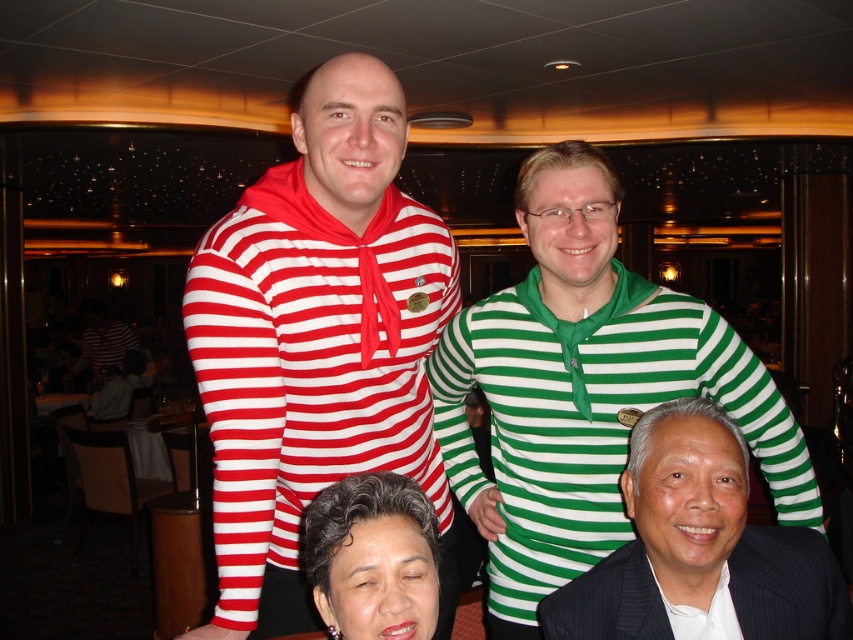
Measure the distance from matte red and white striped hoodie at center to green striped shirt at upper right.

They are 10.96 inches apart.

Is matte red and white striped hoodie at center smaller than green striped shirt at upper right?

Correct, matte red and white striped hoodie at center occupies less space than green striped shirt at upper right.

Is point (450, 252) farther from camera compared to point (543, 464)?

That is True.

Image resolution: width=853 pixels, height=640 pixels. I want to click on matte red and white striped hoodie at center, so [x=317, y=342].

Is matte red and white striped hoodie at center thinner than smooth black hair at lower center?

No.

Who is positioned more to the right, matte red and white striped hoodie at center or smooth black hair at lower center?

Positioned to the right is smooth black hair at lower center.

The height and width of the screenshot is (640, 853). What are the coordinates of `matte red and white striped hoodie at center` in the screenshot? It's located at (317, 342).

Does green striped shirt at upper right lie behind smooth black hair at lower center?

Yes, it is behind smooth black hair at lower center.

Between point (465, 472) and point (375, 611), which one is positioned in front?

Point (375, 611) is in front.

I want to click on green striped shirt at upper right, so click(x=584, y=388).

The width and height of the screenshot is (853, 640). What are the coordinates of `green striped shirt at upper right` in the screenshot? It's located at (584, 388).